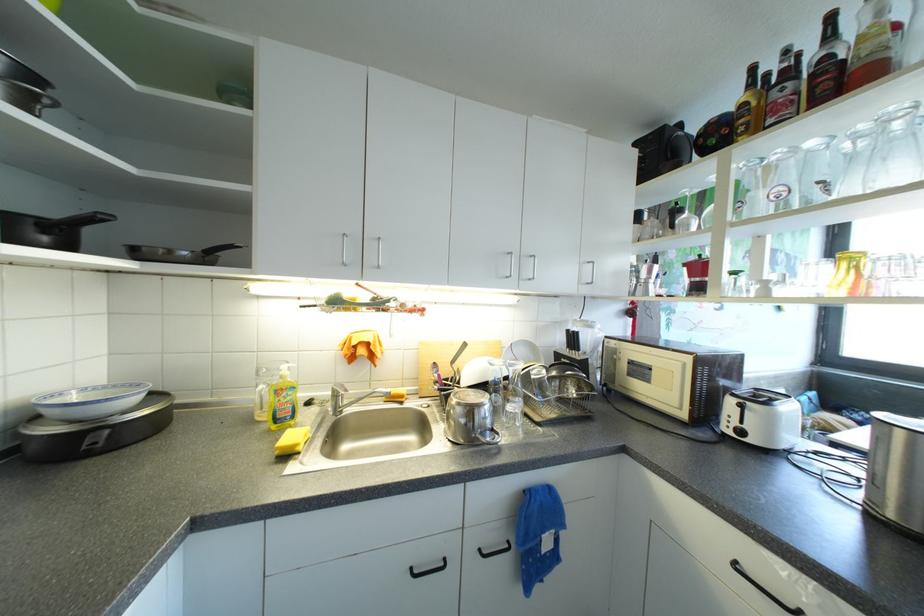
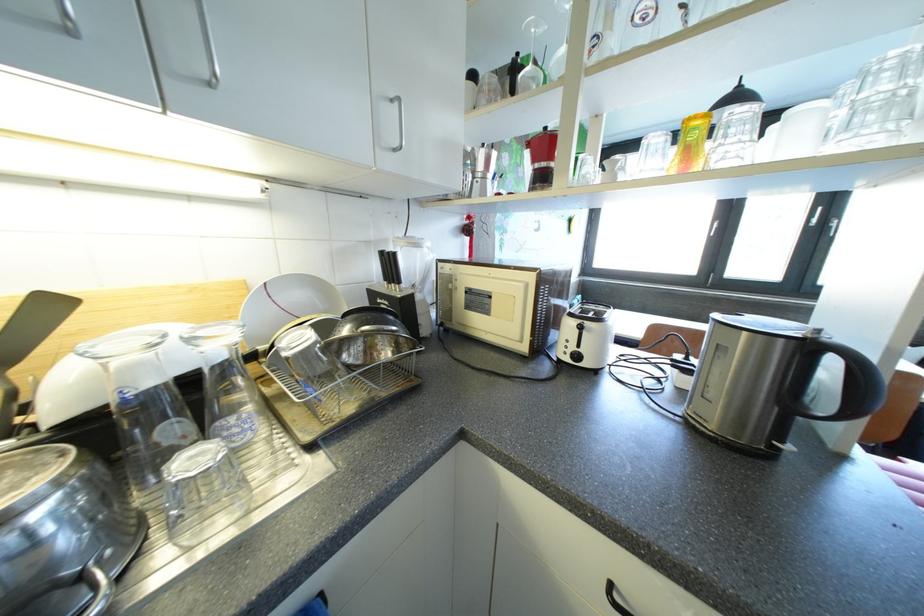
Find the pixel in the second image that matches pixel 681 214 in the first image.

(520, 71)